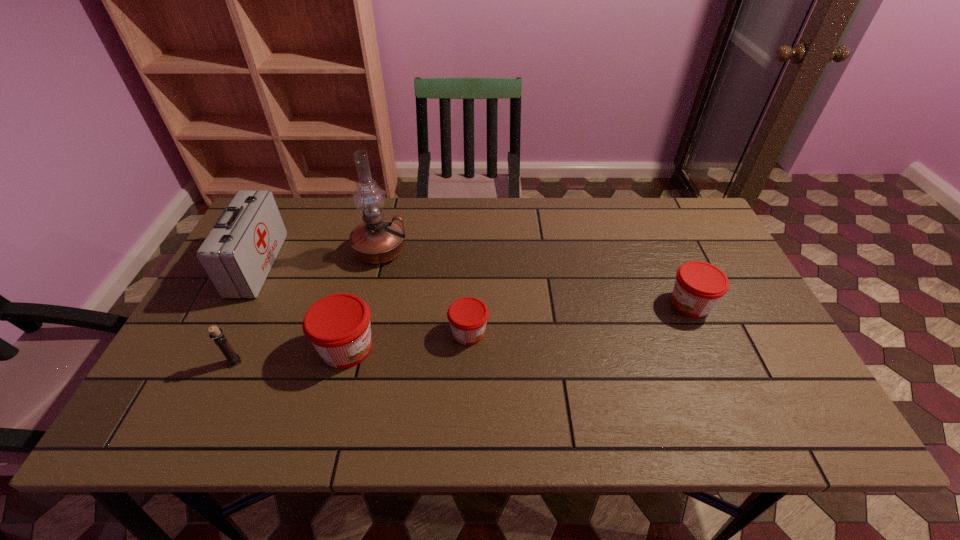
Identify the location of the leftmost jam. (338, 325).

The height and width of the screenshot is (540, 960). Find the location of `the shortest jam`. the shortest jam is located at coordinates (467, 316).

Image resolution: width=960 pixels, height=540 pixels. Identify the location of the fifth object from left to right. (467, 316).

Image resolution: width=960 pixels, height=540 pixels. I want to click on the rightmost jam, so click(699, 286).

Image resolution: width=960 pixels, height=540 pixels. I want to click on the second shortest jam, so click(699, 286).

Find the location of `the fifth shortest object`. the fifth shortest object is located at coordinates (237, 255).

At what (x,y) coordinates should I click in order to perform the action: click on the leftmost object. Please return your answer as a coordinate pair (x, y). Looking at the image, I should click on pyautogui.click(x=237, y=255).

Image resolution: width=960 pixels, height=540 pixels. I want to click on oil lamp, so click(377, 240).

Image resolution: width=960 pixels, height=540 pixels. Find the location of `the fifth object from right to left`. the fifth object from right to left is located at coordinates (233, 359).

Identify the location of vacant space located on the label side of the leftmost jam. This screenshot has height=540, width=960. (436, 348).